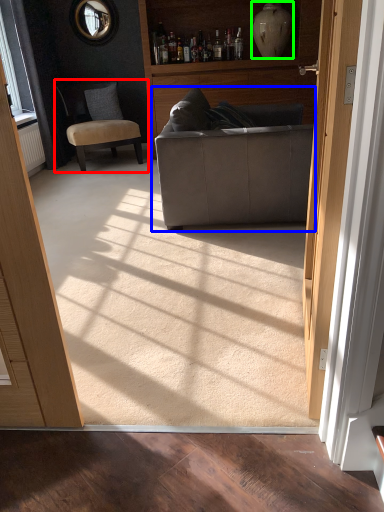
Question: Which object is positioned farthest from chair (highlighted by a red box)? Select from studio couch (highlighted by a blue box) and vase (highlighted by a green box).

Choices:
 (A) studio couch
 (B) vase

Answer: (A)